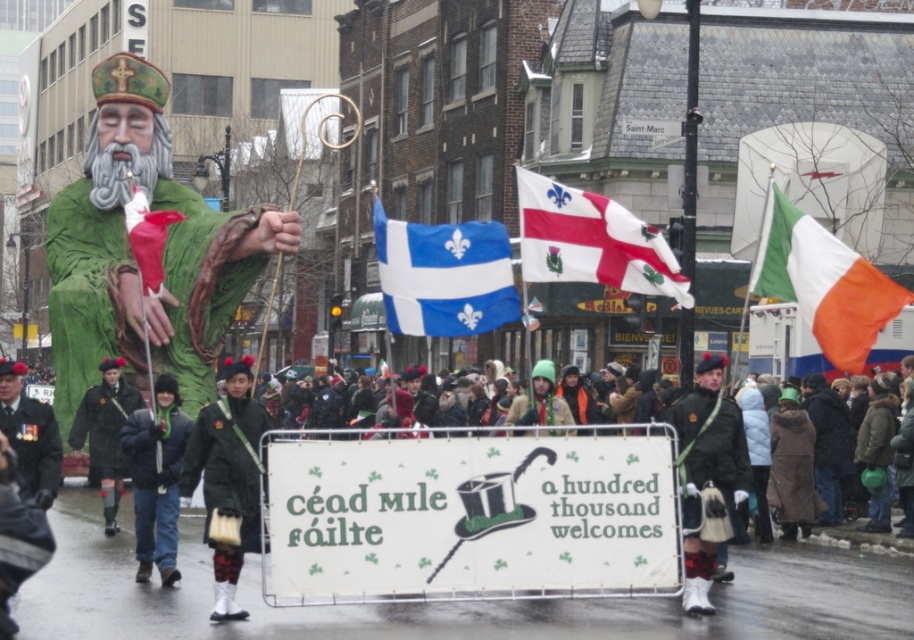
Can you confirm if white fabric flag at center is wider than dark green fabric uniform at center?

Indeed, white fabric flag at center has a greater width compared to dark green fabric uniform at center.

Locate an element on the screen. This screenshot has height=640, width=914. white fabric flag at center is located at coordinates (591, 241).

Between point (864, 305) and point (803, 486), which one is positioned behind?

Positioned behind is point (803, 486).

Who is more forward, (811, 259) or (776, 497)?

Positioned in front is point (811, 259).

I want to click on white fabric flag at upper right, so click(x=822, y=282).

Between dark winter coats at center and dark green uniform at center, which one is positioned higher?

dark green uniform at center is above.

Is dark winter coats at center taller than dark green uniform at center?

Yes, dark winter coats at center is taller than dark green uniform at center.

Between point (101, 573) and point (52, 484), which one is positioned in front?

Point (52, 484)

Where is `dark winter coats at center`? dark winter coats at center is located at coordinates (452, 602).